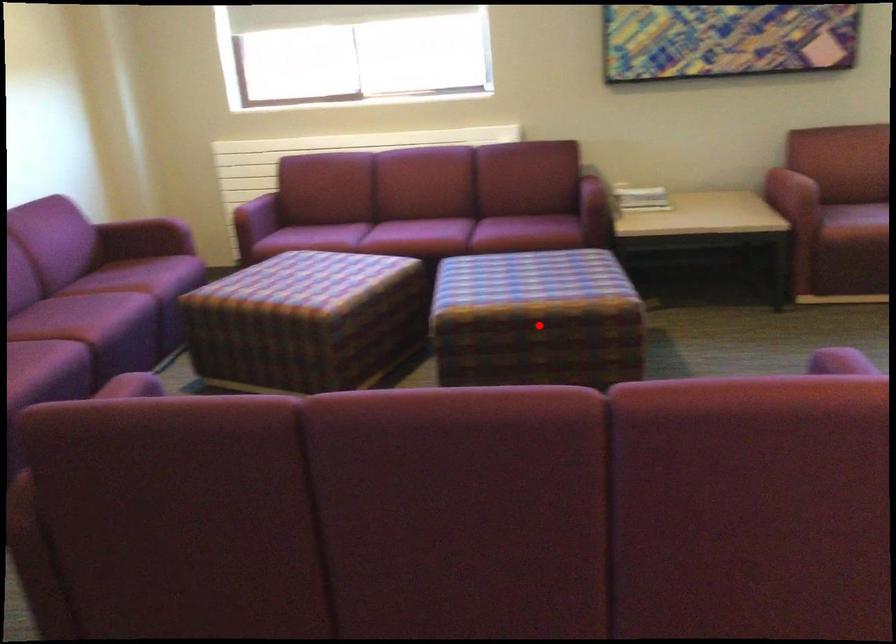
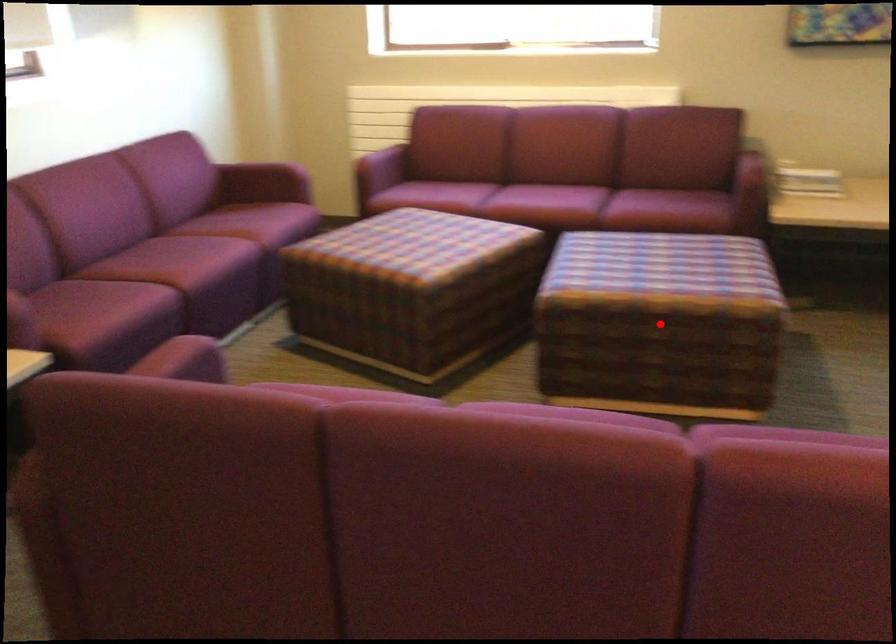
I am providing you with two images of the same scene from different viewpoints. A red point is marked on the first image and another point is marked on the second image. Does the point marked in image1 correspond to the same location as the one in image2?

Yes